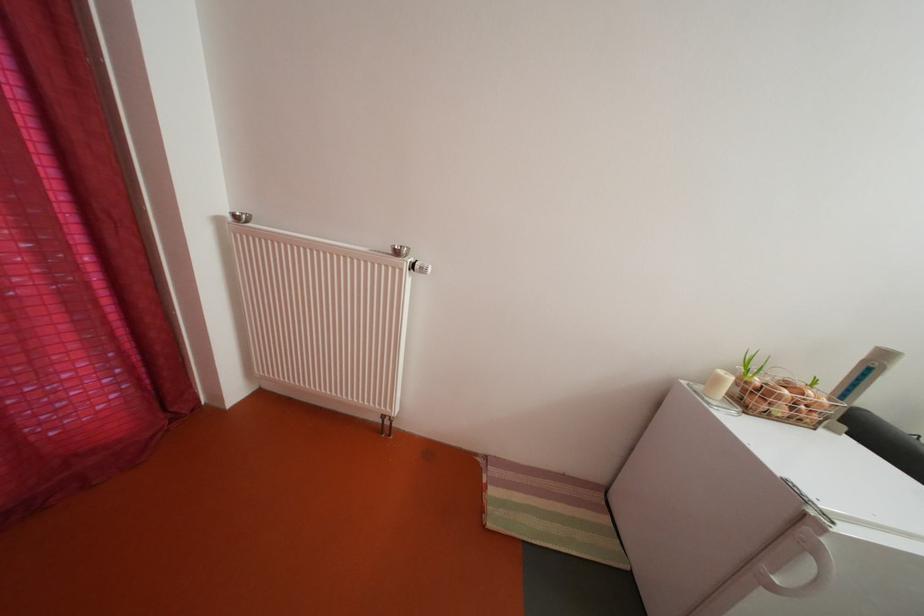
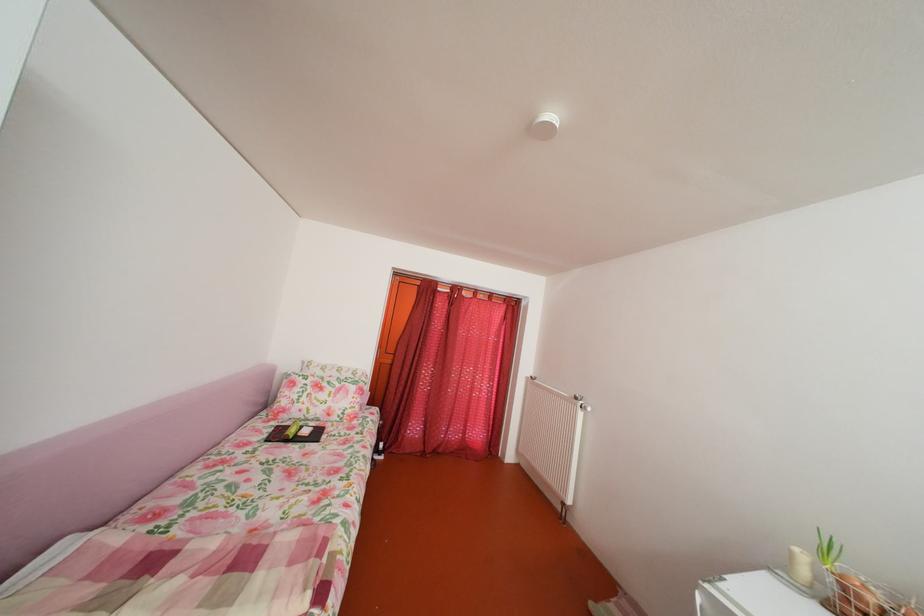
The point at (728, 386) is marked in the first image. Where is the corresponding point in the second image?

(803, 561)